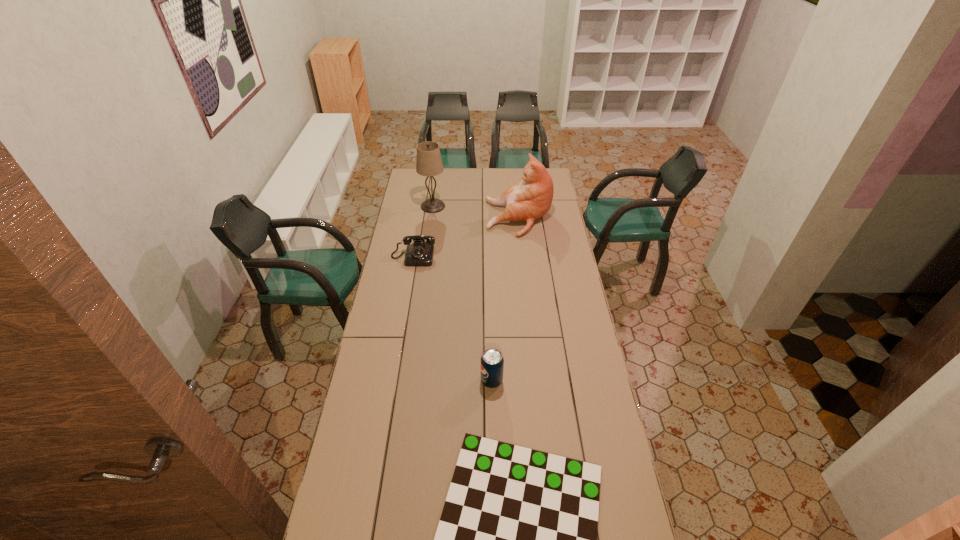
Identify the location of lampshade. (429, 163).

This screenshot has width=960, height=540. In order to click on cat in this screenshot , I will do `click(531, 198)`.

Image resolution: width=960 pixels, height=540 pixels. Identify the location of the fourth farthest object. (492, 362).

Where is `the third tallest object`? Image resolution: width=960 pixels, height=540 pixels. the third tallest object is located at coordinates (492, 362).

At what (x,y) coordinates should I click in order to perform the action: click on telephone. Please return your answer as a coordinate pair (x, y). This screenshot has height=540, width=960. Looking at the image, I should click on click(x=420, y=253).

You are a GUI agent. You are given a task and a screenshot of the screen. Output one action in this format:
    pyautogui.click(x=<x>, y=<y>)
    Task: Click on the second shortest object
    This screenshot has height=540, width=960.
    Given the screenshot: What is the action you would take?
    click(x=420, y=253)

I want to click on vacant space located 0.400m on the front-facing side of the lampshade, so click(515, 206).

Find the location of `free spot located 0.110m on the face of the cat`. free spot located 0.110m on the face of the cat is located at coordinates (466, 218).

Find the location of a particular element. free spot located 0.120m on the face of the cat is located at coordinates (465, 218).

What are the coordinates of `blank space located on the face of the cat` in the screenshot? It's located at (459, 218).